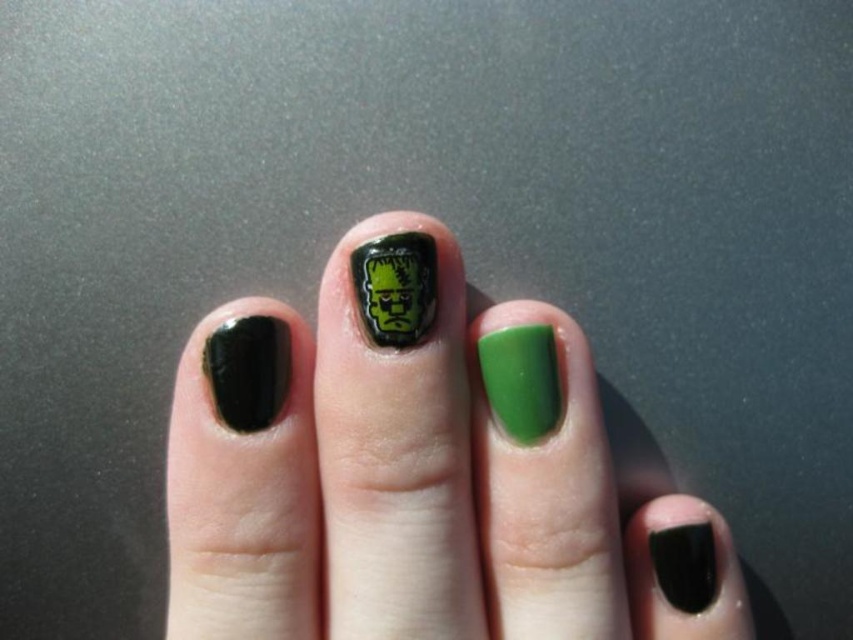
You are holding a ruler and want to measure the distance from your eye to the point at coordinates point (216, 369). Can you determine if this distance is more than 24 inches?

The distance of point (216, 369) from viewer is 24.37 inches, so yes, the distance is more than 24 inches.

You are a nail artist observing the hand in the image. You need to apply a new design starting from the point closer to the camera. Which point should you start with, point (413, 346) or point (234, 348)?

Point (413, 346) is in front of point (234, 348), so you should start with point (413, 346) since it is closer to the camera.